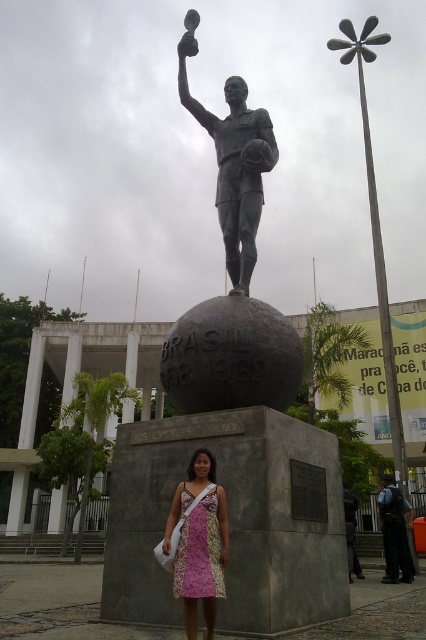
Question: Does polished bronze statue at center have a greater width compared to pink floral dress at center?

Choices:
 (A) yes
 (B) no

Answer: (A)

Question: Is pink floral dress at center below dark blue uniform at center?

Choices:
 (A) yes
 (B) no

Answer: (B)

Question: Considering the real-world distances, which object is farthest from the bronze statue at center?

Choices:
 (A) pink floral dress at center
 (B) dark blue uniform at center
 (C) polished bronze statue at center

Answer: (B)

Question: Which of the following is the closest to the observer?

Choices:
 (A) dark blue uniform at center
 (B) polished bronze statue at center
 (C) pink floral dress at center

Answer: (C)

Question: Observing the image, what is the correct spatial positioning of polished bronze statue at center in reference to bronze statue at center?

Choices:
 (A) below
 (B) above

Answer: (A)

Question: Which point is closer to the camera?

Choices:
 (A) bronze statue at center
 (B) dark blue uniform at center

Answer: (A)